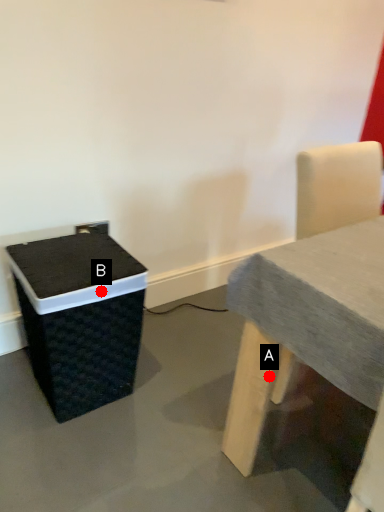
Question: Two points are circled on the image, labeled by A and B beside each circle. Which point is farther from the camera taking this photo?

Choices:
 (A) A is further
 (B) B is further

Answer: (B)